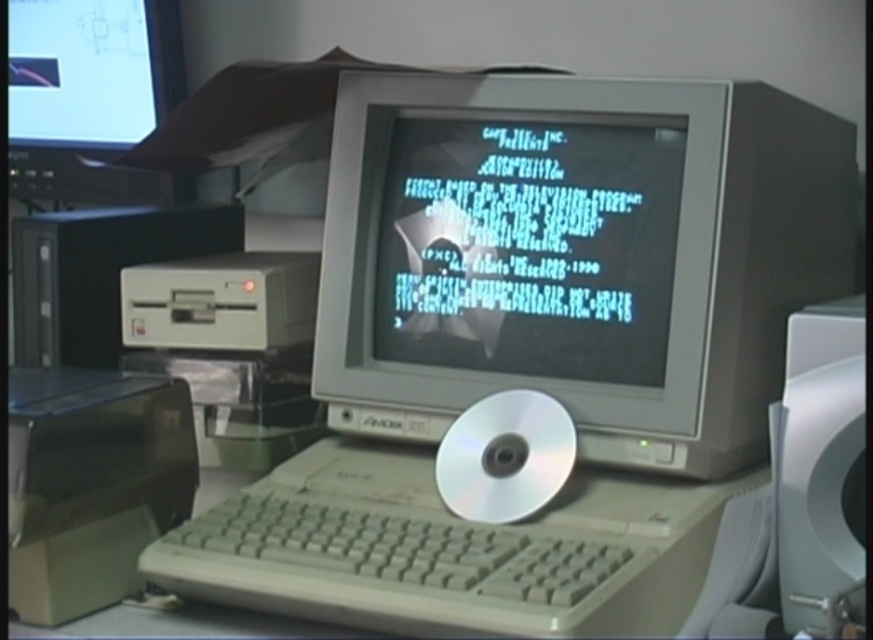
Question: Does matte plastic monitor at center come in front of white plastic speaker at right?

Choices:
 (A) no
 (B) yes

Answer: (A)

Question: Which point is farther from the camera taking this photo?

Choices:
 (A) (588, 320)
 (B) (104, 74)
 (C) (447, 628)
 (D) (856, 428)

Answer: (B)

Question: Can you confirm if matte plastic monitor at center is positioned below white plastic keyboard at center?

Choices:
 (A) yes
 (B) no

Answer: (B)

Question: Which point is closer to the camera?

Choices:
 (A) white plastic keyboard at center
 (B) matte plastic monitor at center
 (C) matte black monitor at upper left
 (D) white plastic speaker at right

Answer: (A)

Question: Which object is positioned farthest from the matte plastic monitor at center?

Choices:
 (A) white plastic speaker at right
 (B) matte black monitor at upper left

Answer: (B)

Question: Does matte plastic monitor at center appear under white plastic speaker at right?

Choices:
 (A) yes
 (B) no

Answer: (B)